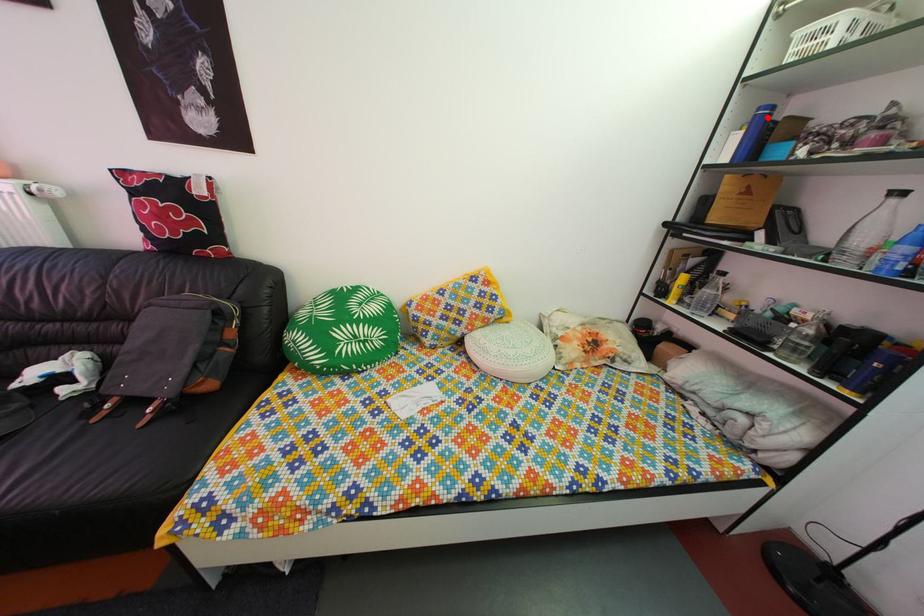
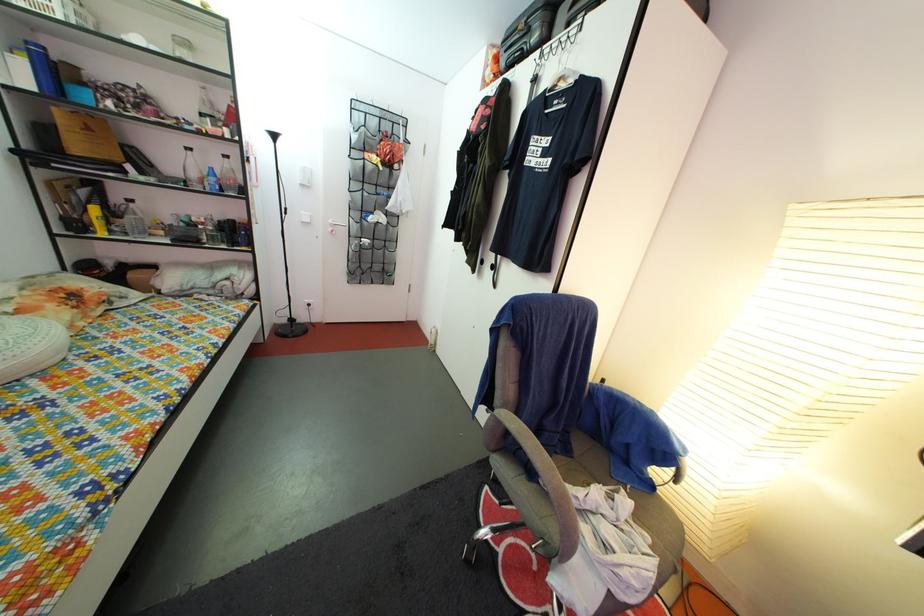
Question: A red point is marked in image1. In image2, is the corresponding 3D point closer to the camera or farther? Reply with the corresponding letter.

Choices:
 (A) The corresponding 3D point is closer.
 (B) The corresponding 3D point is farther.

Answer: (B)